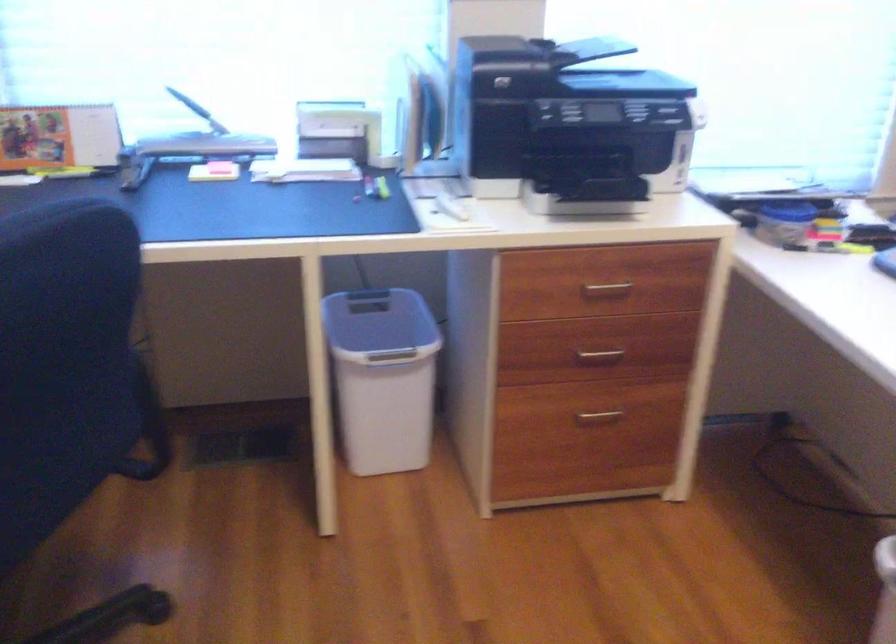
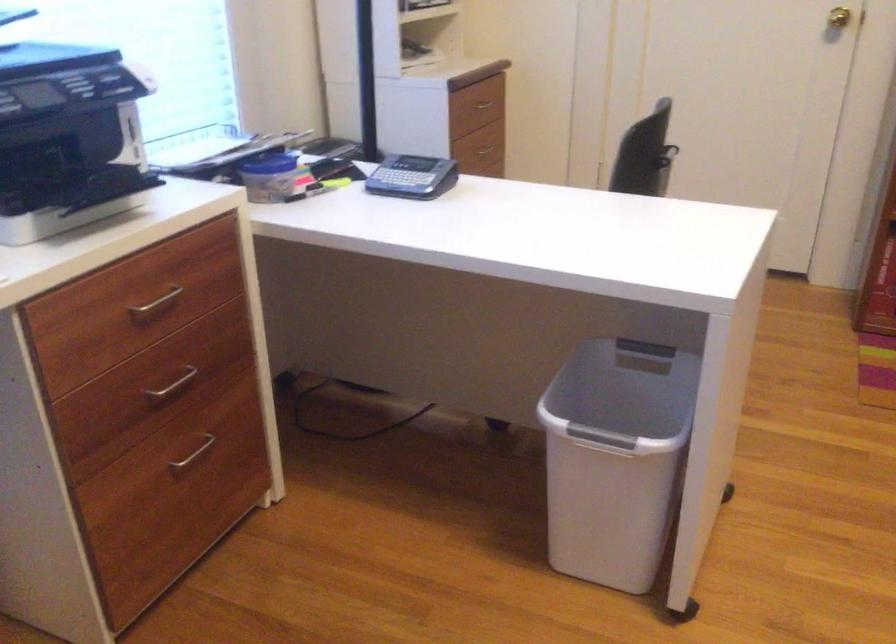
The point at (607, 285) is marked in the first image. Where is the corresponding point in the second image?

(156, 303)